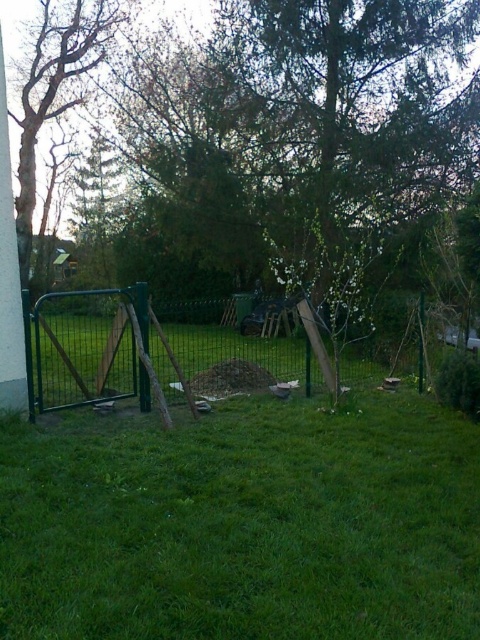
You are planning to install a new fence in your backyard. You have a green metal fence at left and a smooth bark tree at left in your current setup. Which one takes up more space in the backyard?

The green metal fence at left is larger in size than the smooth bark tree at left, so the green metal fence at left takes up more space in the backyard.

You are a painter who needs to paint the green metal fence at left and the smooth bark tree at left. Which object requires a taller ladder to reach its top?

The green metal fence at left requires a taller ladder because it has a greater height compared to the smooth bark tree at left.